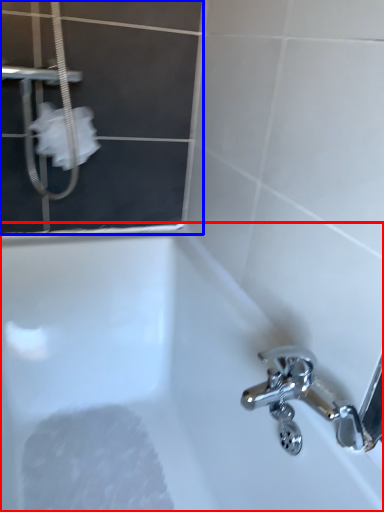
Question: Which object appears farthest to the camera in this image, bathtub (highlighted by a red box) or screen door (highlighted by a blue box)?

Choices:
 (A) bathtub
 (B) screen door

Answer: (B)